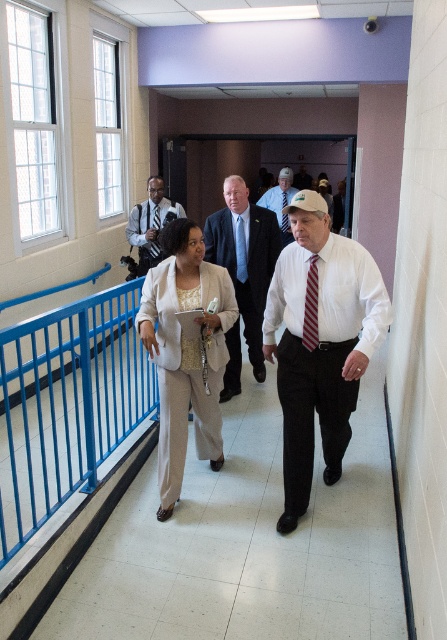
Question: Which object is farther from the camera taking this photo?

Choices:
 (A) white textured shirt at center
 (B) blue suit at center

Answer: (B)

Question: Estimate the real-world distances between objects in this image. Which object is farther from the white textured shirt at center?

Choices:
 (A) blue metallic handrail at left
 (B) matte black suit at center
 (C) beige fabric suit at center
 (D) striped fabric tie at center

Answer: (B)

Question: Which object is positioned farthest from the blue silk tie at center?

Choices:
 (A) white textured shirt at center
 (B) black silk tie at center
 (C) beige fabric suit at center
 (D) blue suit at center

Answer: (A)

Question: Can you confirm if light blue fabric tie at center is positioned to the right of striped fabric tie at center?

Choices:
 (A) yes
 (B) no

Answer: (A)

Question: Is striped fabric tie at center positioned in front of black silk tie at center?

Choices:
 (A) no
 (B) yes

Answer: (B)

Question: Is striped fabric tie at center closer to camera compared to black silk tie at center?

Choices:
 (A) yes
 (B) no

Answer: (A)